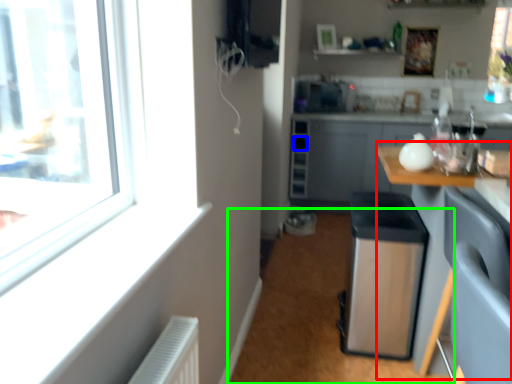
Question: Which object is the farthest from table (highlighted by a red box)? Choose among these: drawer (highlighted by a blue box) or plain (highlighted by a green box).

Choices:
 (A) drawer
 (B) plain

Answer: (A)